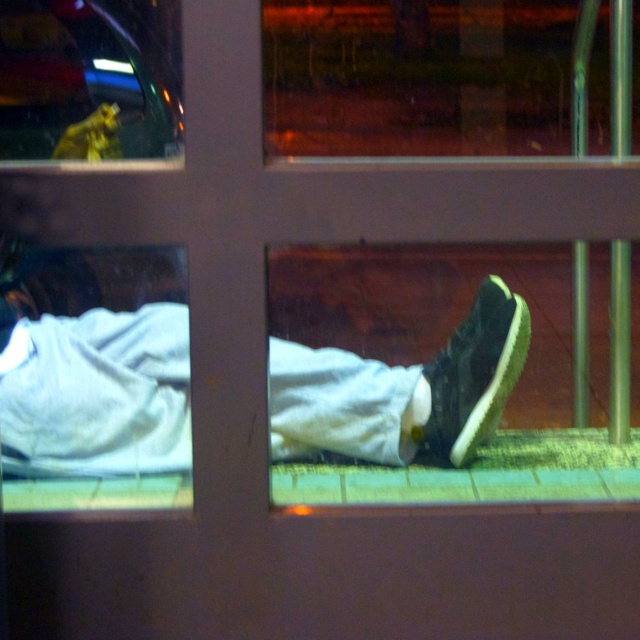
Between clear glass window at upper left and black suede shoe at lower right, which one has more height?

clear glass window at upper left is taller.

Does clear glass window at upper left appear under black suede shoe at lower right?

Incorrect, clear glass window at upper left is not positioned below black suede shoe at lower right.

Which is in front, point (20, 17) or point (484, 352)?

Point (484, 352) is in front.

Image resolution: width=640 pixels, height=640 pixels. I want to click on clear glass window at upper left, so click(x=90, y=81).

This screenshot has width=640, height=640. Describe the element at coordinates (97, 394) in the screenshot. I see `white matte pants at lower center` at that location.

Can you confirm if white matte pants at lower center is taller than black suede shoe at lower right?

In fact, white matte pants at lower center may be shorter than black suede shoe at lower right.

In order to click on white matte pants at lower center in this screenshot , I will do `click(97, 394)`.

Between white matte pants at lower center and clear glass window at upper left, which one has more height?

clear glass window at upper left is taller.

Does white matte pants at lower center have a lesser height compared to clear glass window at upper left?

Yes, white matte pants at lower center is shorter than clear glass window at upper left.

What do you see at coordinates (97, 394) in the screenshot? I see `white matte pants at lower center` at bounding box center [97, 394].

Locate an element on the screen. white matte pants at lower center is located at coordinates (97, 394).